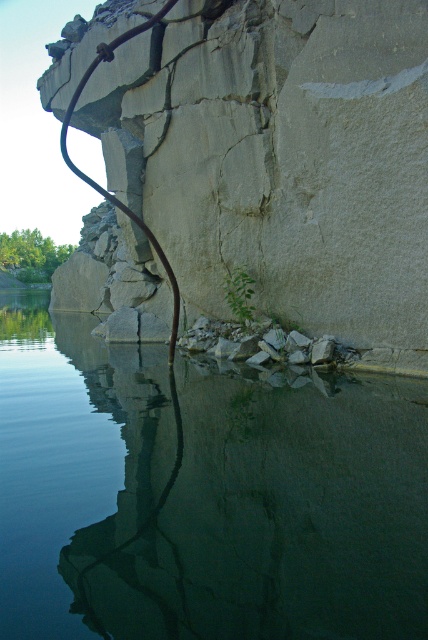
You are standing at the edge of the water in the scene. There is a point labeled as point (202,493). What is located at that point?

The point (202,493) indicates clear water at center.

You are a kayaker approaching the smooth concrete cliff at center from the left. To avoid hitting the cliff, you need to move to the right. Will the clear water at center be to your right or left after moving?

The clear water at center is to the right of the smooth concrete cliff at center. Since you moved to the right to avoid the cliff, the clear water at center will now be on your left side.